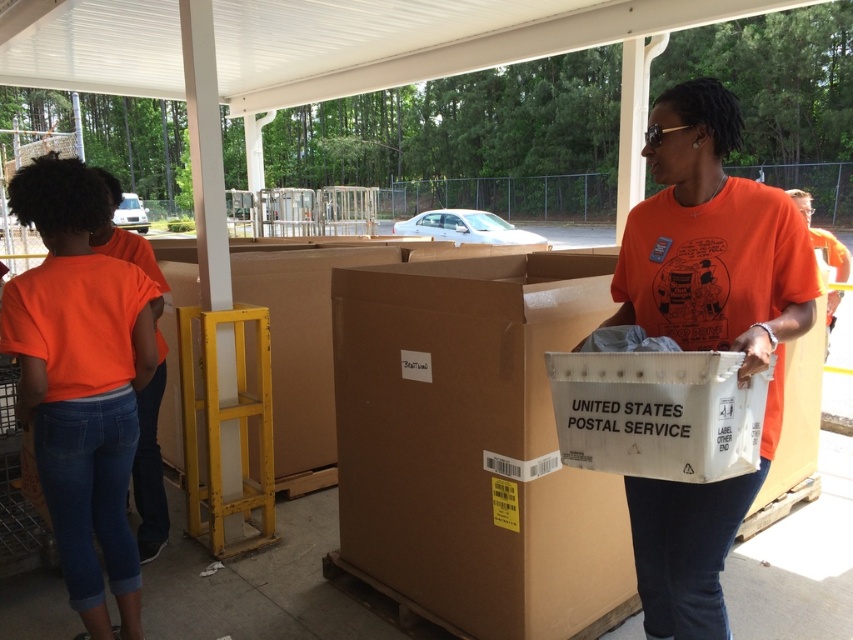
Between orange cotton shirt at left and white cardboard box at center, which one appears on the left side from the viewer's perspective?

orange cotton shirt at left is more to the left.

Can you confirm if orange cotton shirt at left is smaller than white cardboard box at center?

Actually, orange cotton shirt at left might be larger than white cardboard box at center.

Who is more distant from viewer, (100, 627) or (613, 433)?

Positioned behind is point (100, 627).

Image resolution: width=853 pixels, height=640 pixels. I want to click on orange cotton shirt at left, so click(x=80, y=381).

Image resolution: width=853 pixels, height=640 pixels. Describe the element at coordinates (706, 333) in the screenshot. I see `orange cotton shirt at center` at that location.

Which is more to the right, orange cotton shirt at center or white cardboard box at center?

orange cotton shirt at center is more to the right.

Does point (677, 516) come behind point (659, 358)?

That is True.

In order to click on orange cotton shirt at center in this screenshot , I will do `click(706, 333)`.

Who is positioned more to the left, orange cotton shirt at center or orange cotton shirt at left?

From the viewer's perspective, orange cotton shirt at left appears more on the left side.

Who is taller, orange cotton shirt at center or orange cotton shirt at left?

orange cotton shirt at left

What do you see at coordinates (706, 333) in the screenshot?
I see `orange cotton shirt at center` at bounding box center [706, 333].

This screenshot has height=640, width=853. I want to click on orange cotton shirt at center, so click(x=706, y=333).